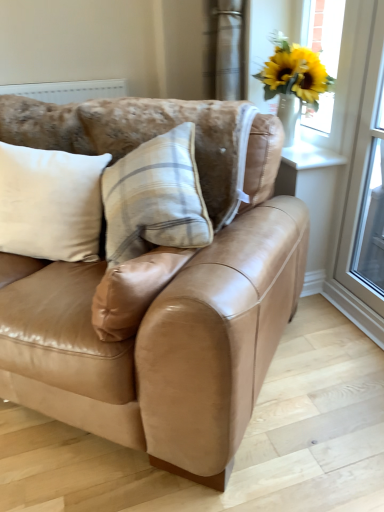
Identify the location of empty space that is ontop of white glossy window sill at upper right. The image size is (384, 512). (307, 146).